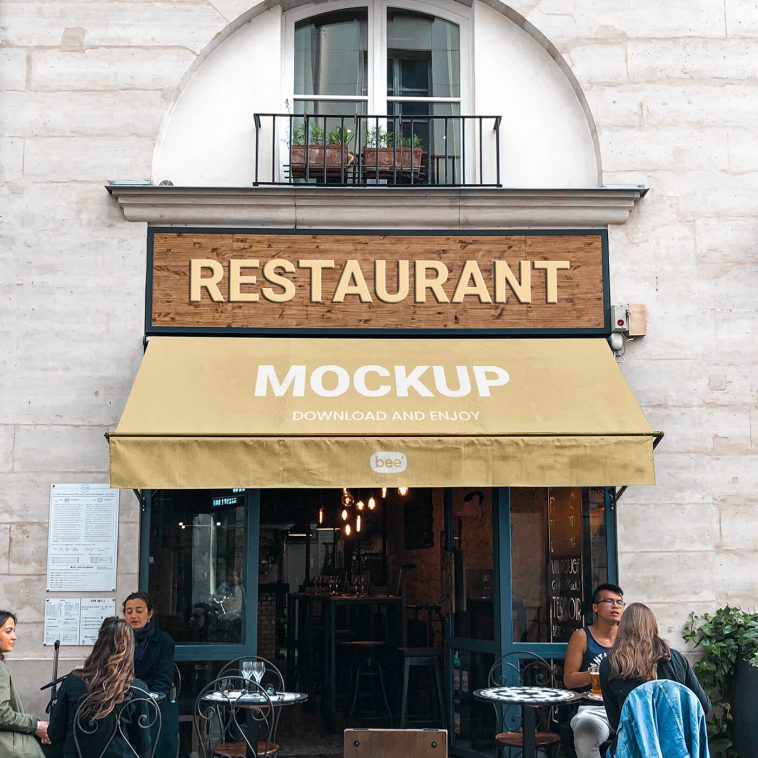
Locate an element on the screen. The image size is (758, 758). window is located at coordinates 406,66, 334,80.